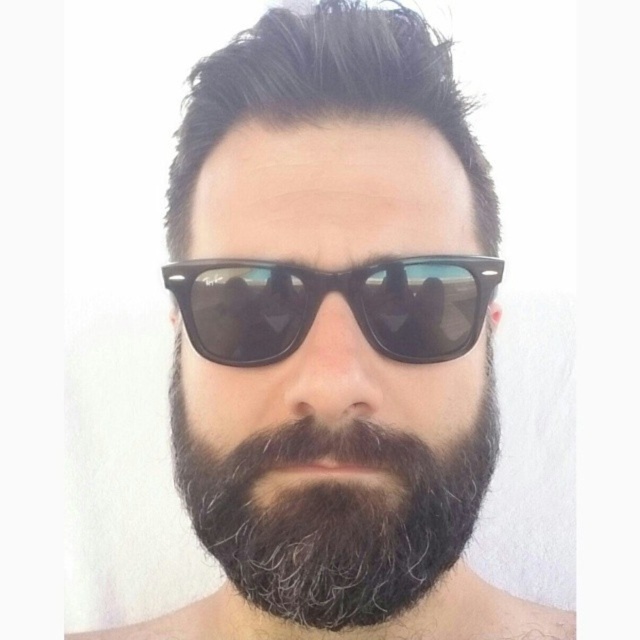
Question: Which object appears closest to the camera in this image?

Choices:
 (A) dark brown textured beard at center
 (B) black plastic sunglasses at center
 (C) dark brown hair at center

Answer: (A)

Question: Considering the relative positions of dark brown textured beard at center and black plastic sunglasses at center in the image provided, where is dark brown textured beard at center located with respect to black plastic sunglasses at center?

Choices:
 (A) left
 (B) right

Answer: (B)

Question: Which object is the farthest from the dark brown textured beard at center?

Choices:
 (A) black plastic sunglasses at center
 (B) dark brown hair at center

Answer: (B)

Question: Is dark brown textured beard at center wider than dark brown hair at center?

Choices:
 (A) yes
 (B) no

Answer: (B)

Question: Which of the following is the farthest from the observer?

Choices:
 (A) (214, 276)
 (B) (220, 481)
 (C) (381, 42)

Answer: (C)

Question: Does dark brown hair at center appear under black plastic sunglasses at center?

Choices:
 (A) yes
 (B) no

Answer: (B)